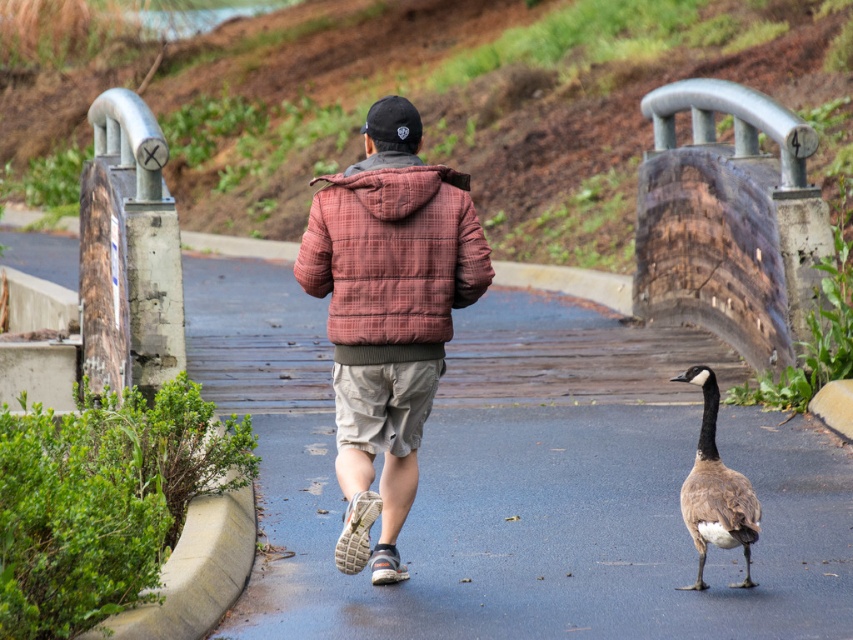
What is the exact coordinate of the smooth asphalt road at center?

The smooth asphalt road at center is located at point (521, 477).